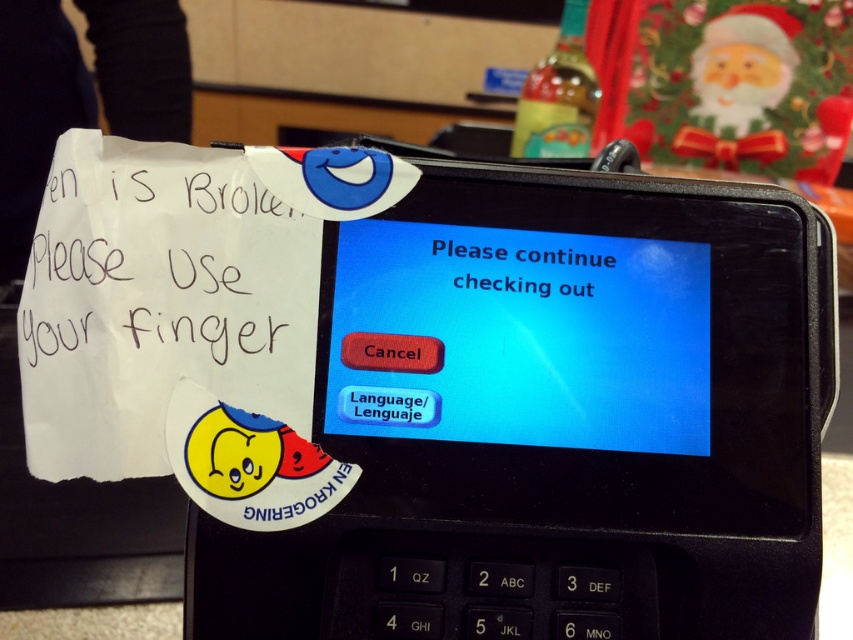
Is point (219, 492) positioned before point (541, 282)?

Yes, point (219, 492) is in front of point (541, 282).

Can you confirm if yellow paper sticker at lower left is taller than blue glossy text at center?

Indeed, yellow paper sticker at lower left has a greater height compared to blue glossy text at center.

What do you see at coordinates (248, 464) in the screenshot?
I see `yellow paper sticker at lower left` at bounding box center [248, 464].

This screenshot has height=640, width=853. I want to click on yellow paper sticker at lower left, so click(248, 464).

Can you confirm if white paper at left is bigger than blue glossy text at center?

Yes.

Between white paper at left and blue glossy text at center, which one appears on the right side from the viewer's perspective?

blue glossy text at center

Image resolution: width=853 pixels, height=640 pixels. Describe the element at coordinates (165, 273) in the screenshot. I see `white paper at left` at that location.

Identify the location of white paper at left. Image resolution: width=853 pixels, height=640 pixels. (165, 273).

Is white paper at left below yellow paper sticker at lower left?

No.

Describe the element at coordinates (165, 273) in the screenshot. I see `white paper at left` at that location.

You are a GUI agent. You are given a task and a screenshot of the screen. Output one action in this format:
    pyautogui.click(x=<x>, y=<y>)
    Task: Click on the white paper at left
    The image size is (853, 640).
    Given the screenshot: What is the action you would take?
    pyautogui.click(x=165, y=273)